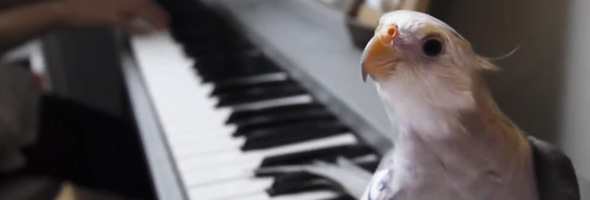
Where is `wall behind bird`? This screenshot has width=590, height=200. wall behind bird is located at coordinates (542, 43).